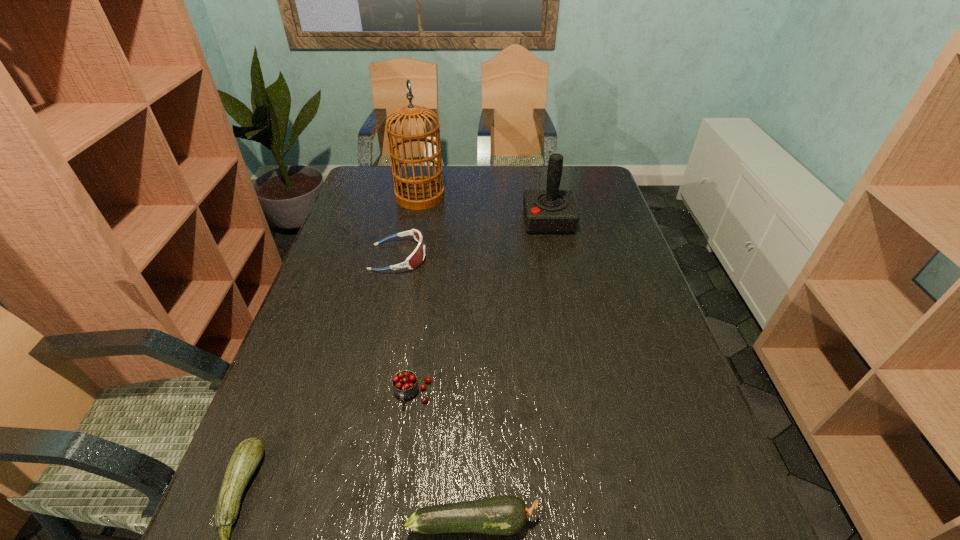
Find the location of a particular element. This screenshot has height=540, width=960. free space between the tallest object and the fourth nearest object is located at coordinates (409, 227).

Where is `free space between the tallest object and the cherry`? This screenshot has width=960, height=540. free space between the tallest object and the cherry is located at coordinates (417, 295).

Locate an element on the screen. This screenshot has width=960, height=540. object that is the fourth closest to the joystick is located at coordinates (506, 515).

Choose which object is the nearest neighbor to the right zucchini. Please provide its 2D coordinates. Your answer should be formatted as a tuple, i.e. [(x, y)], where the tuple contains the x and y coordinates of a point satisfying the conditions above.

[(405, 385)]